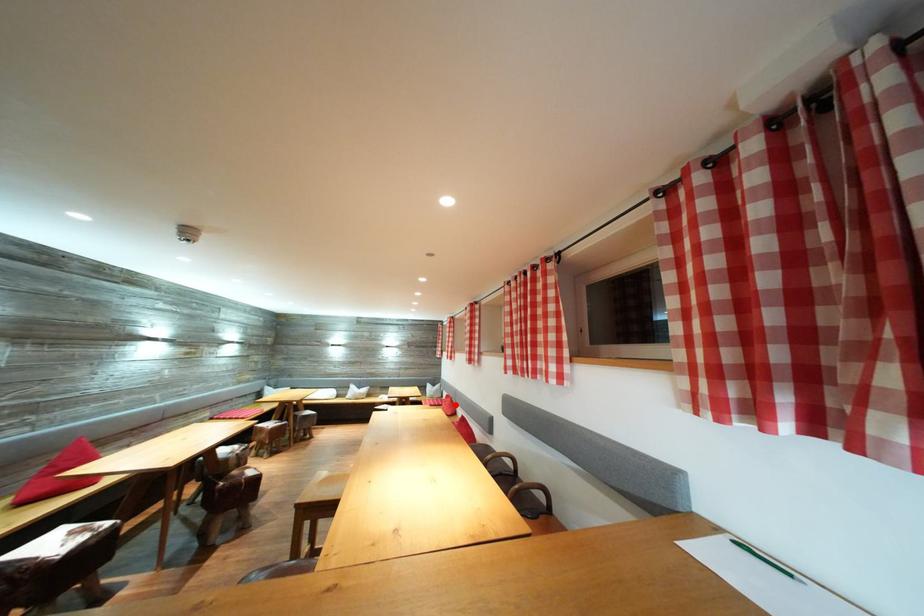
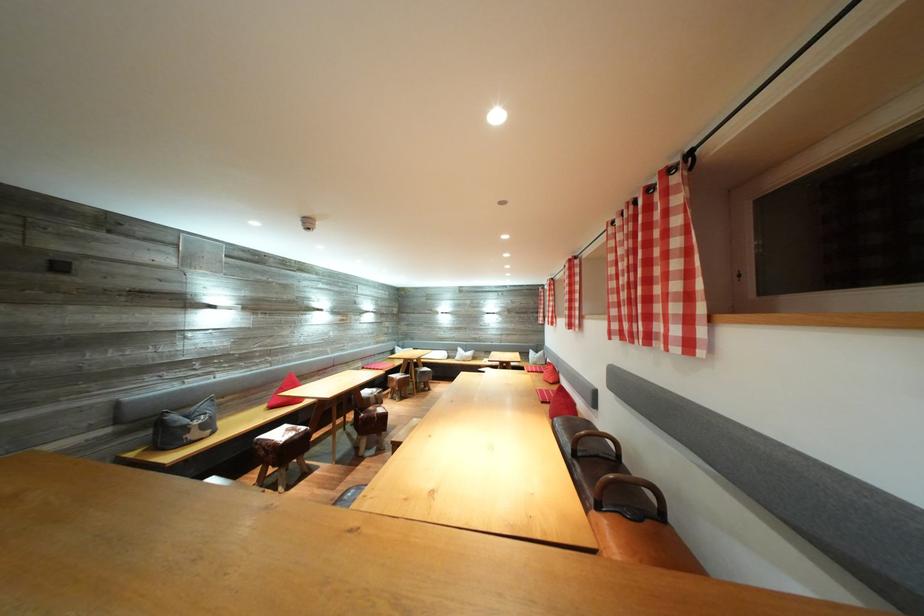
The point at the highlighted location is marked in the first image. Where is the corresponding point in the second image?

(557, 373)